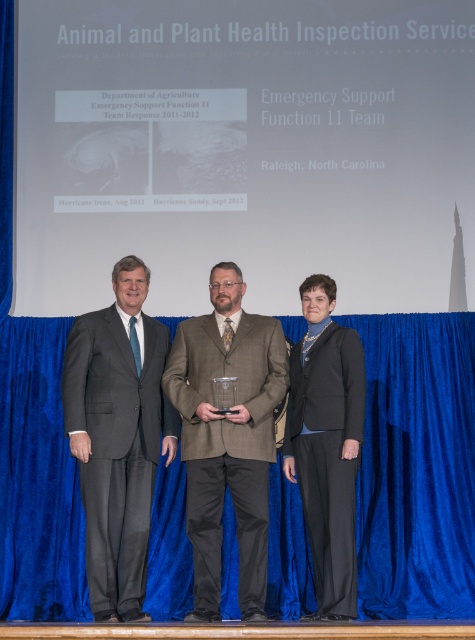
Does gray suit at left appear on the left side of brown wool suit at center?

Correct, you'll find gray suit at left to the left of brown wool suit at center.

Is gray suit at left bigger than brown wool suit at center?

No, gray suit at left is not bigger than brown wool suit at center.

Locate an element on the screen. gray suit at left is located at coordinates (117, 436).

Does blue velvet curtain at center appear under gray suit at left?

Correct, blue velvet curtain at center is located below gray suit at left.

Is blue velvet curtain at center to the left of gray suit at left from the viewer's perspective?

Indeed, blue velvet curtain at center is positioned on the left side of gray suit at left.

Is point (62, 522) positioned after point (102, 512)?

Yes.

This screenshot has width=475, height=640. I want to click on blue velvet curtain at center, so click(x=416, y=467).

Does blue velvet curtain at center appear under black fabric suit at center?

Correct, blue velvet curtain at center is located below black fabric suit at center.

The width and height of the screenshot is (475, 640). In order to click on blue velvet curtain at center in this screenshot , I will do `click(416, 467)`.

I want to click on blue velvet curtain at center, so click(x=416, y=467).